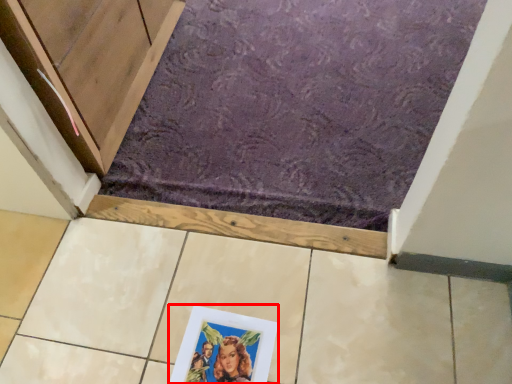
Question: From the image's perspective, where is picture frame (annotated by the red box) located in relation to bath mat in the image?

Choices:
 (A) below
 (B) above

Answer: (A)